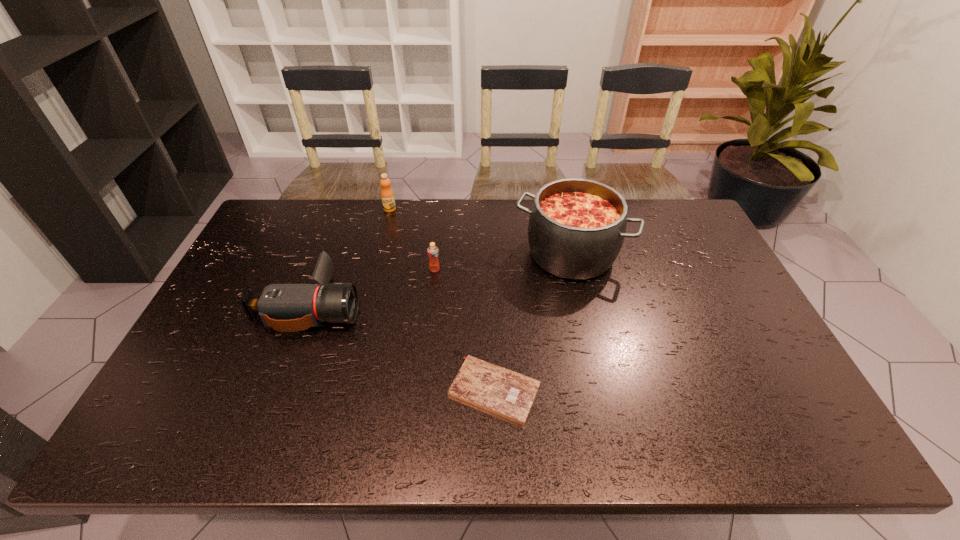
Where is `the tallest object`? This screenshot has height=540, width=960. the tallest object is located at coordinates point(577,226).

Where is `the farther orange juice`? The height and width of the screenshot is (540, 960). the farther orange juice is located at coordinates (387, 195).

Image resolution: width=960 pixels, height=540 pixels. Find the location of `the taller orange juice`. the taller orange juice is located at coordinates (387, 195).

This screenshot has height=540, width=960. I want to click on camcorder, so pyautogui.click(x=285, y=307).

Find the location of a particular element. the third object from right to left is located at coordinates (433, 252).

Identify the location of the shorter orange juice. (433, 252).

The width and height of the screenshot is (960, 540). Identify the location of the shortest object. (503, 392).

This screenshot has width=960, height=540. In order to click on Bible in this screenshot , I will do `click(503, 392)`.

Where is `vacant space located 0.160m on the left of the tallest object`? This screenshot has width=960, height=540. vacant space located 0.160m on the left of the tallest object is located at coordinates point(465,254).

Identify the location of free spot located 0.110m on the front label of the taller orange juice. (384, 232).